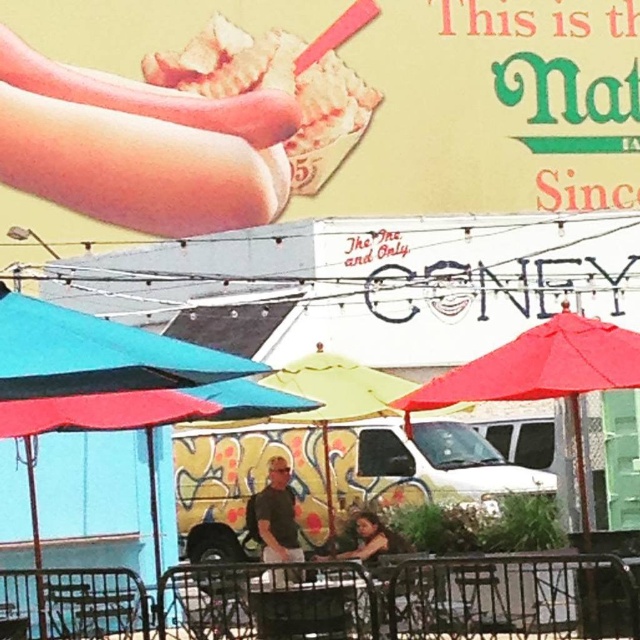
You are a customer at the food stand and want to sit under an umbrella that provides more shade. Which umbrella should you choose between the teal fabric umbrella at left and the red fabric umbrella at right?

The teal fabric umbrella at left is larger in size compared to the red fabric umbrella at right, so it provides more shade. You should choose the teal fabric umbrella at left.